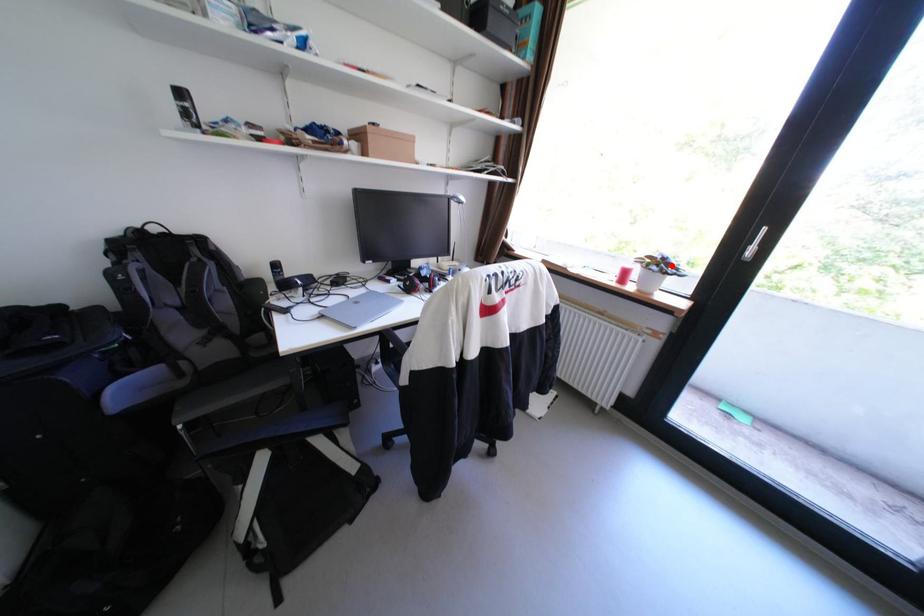
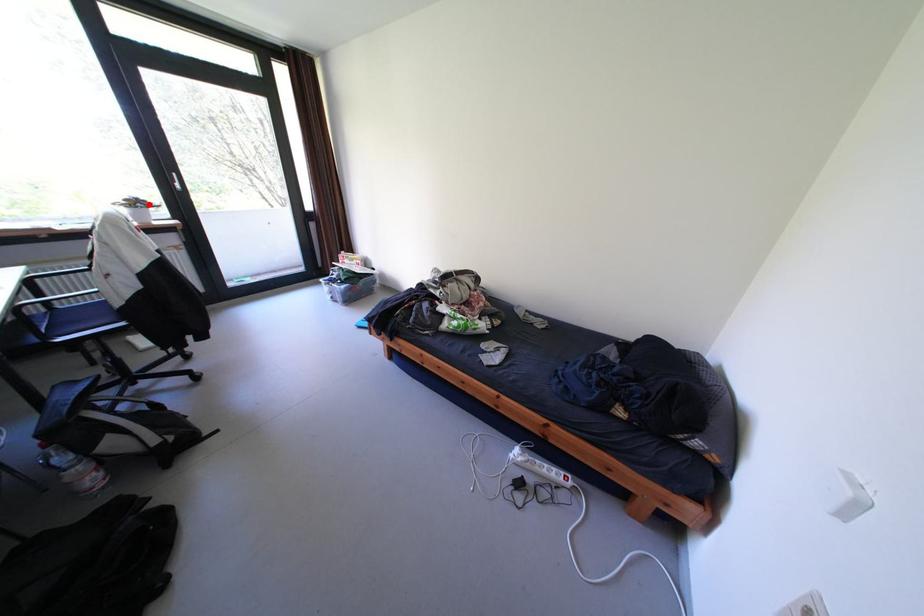
I am providing you with two images of the same scene from different viewpoints. A red point is marked on the first image and another point is marked on the second image. Are the points marked in image1 and image2 representing the same 3D position?

Yes